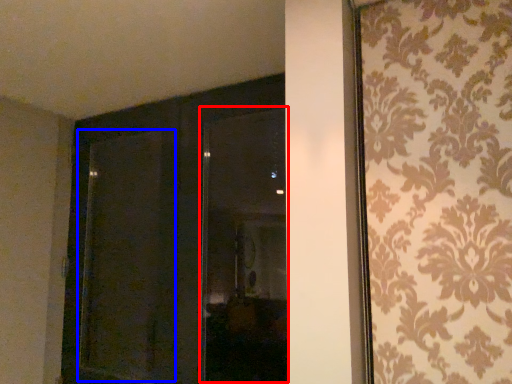
Question: Among these objects, which one is nearest to the camera, window (highlighted by a red box) or screen door (highlighted by a blue box)?

Choices:
 (A) window
 (B) screen door

Answer: (A)